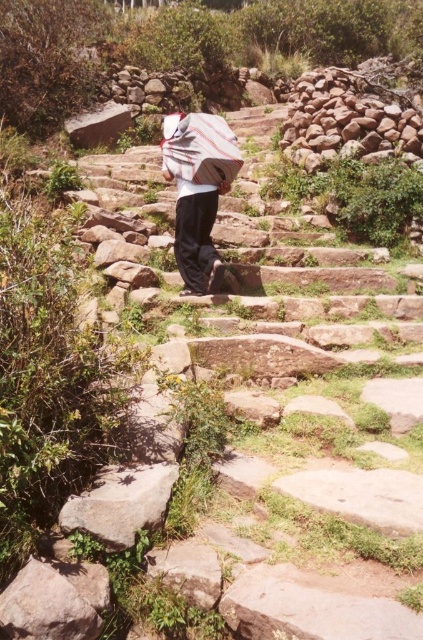
You are a hiker trying to reach the top of the stone steps. You see a smooth stone wall at upper right and a white striped fabric umbrella at center. How far apart are these two objects in feet?

The smooth stone wall at upper right and the white striped fabric umbrella at center are 9.05 feet apart from each other.

You are standing at the base of the stone steps and want to place a 10 feet long ladder between the two points marked as point (140,480). Will the ladder fit between them?

The distance between the two points marked as point (140,480) is 12.55 feet, so the 10 feet long ladder will fit between them since it is shorter than the distance between the points.

You are a hiker trying to navigate the steps. You see the white striped shirt at center and the gray rough rock at lower left. Which object is closer to your right side as you face upwards along the steps?

The white striped shirt at center is to the right of gray rough rock at lower left, so the white striped shirt at center would be closer to your right side as you face upwards along the steps.